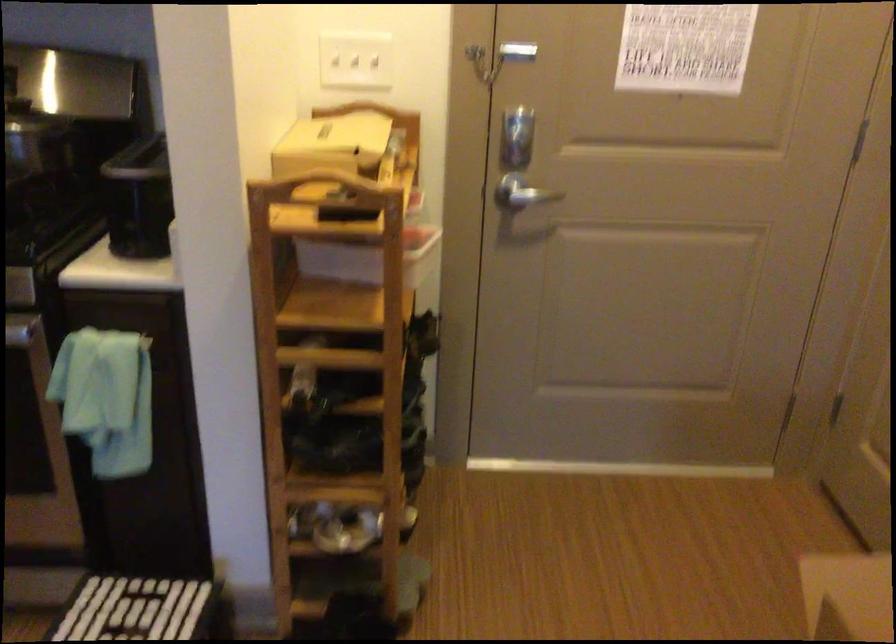
The location [352,526] corresponds to which object?

This point indicates the light-colored shoe.